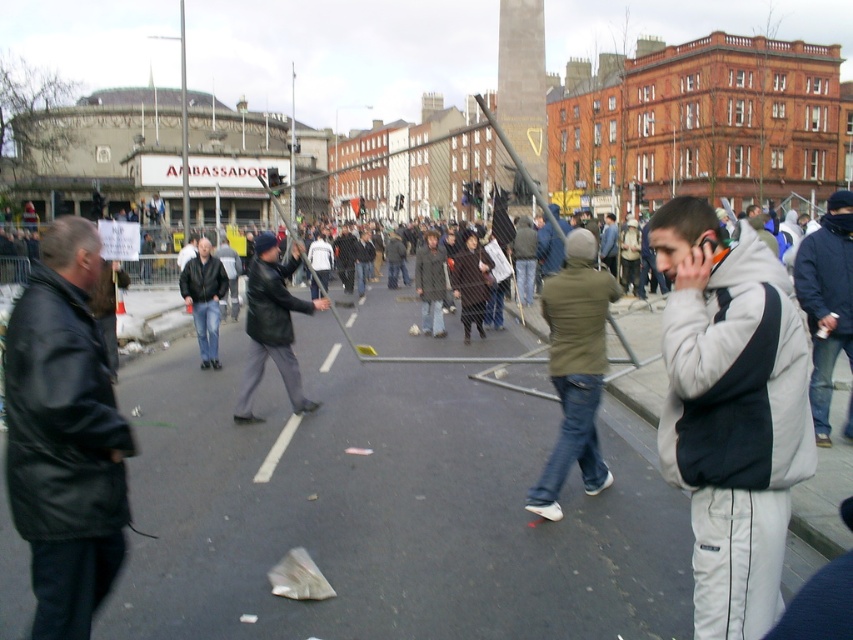
Does black leather jacket at left have a greater width compared to black leather jacket at center?

No, black leather jacket at left is not wider than black leather jacket at center.

Does black leather jacket at left appear under black leather jacket at center?

Incorrect, black leather jacket at left is not positioned below black leather jacket at center.

Where is `black leather jacket at left`? The height and width of the screenshot is (640, 853). black leather jacket at left is located at coordinates (x=64, y=435).

Locate an element on the screen. The width and height of the screenshot is (853, 640). black leather jacket at left is located at coordinates (64, 435).

Is gray fleece jacket at center above black leather jacket at left?

Incorrect, gray fleece jacket at center is not positioned above black leather jacket at left.

Based on the photo, does gray fleece jacket at center have a larger size compared to black leather jacket at left?

Correct, gray fleece jacket at center is larger in size than black leather jacket at left.

Identify the location of gray fleece jacket at center. Image resolution: width=853 pixels, height=640 pixels. (730, 412).

Can you confirm if dark blue jacket at center is bigger than black leather jacket at center?

Yes.

Does dark blue jacket at center come behind black leather jacket at center?

No, it is not.

Which is behind, point (828, 298) or point (293, 371)?

The point (293, 371) is behind.

You are a GUI agent. You are given a task and a screenshot of the screen. Output one action in this format:
    pyautogui.click(x=<x>, y=<y>)
    Task: Click on the dark blue jacket at center
    The height and width of the screenshot is (640, 853).
    Given the screenshot: What is the action you would take?
    pyautogui.click(x=827, y=300)